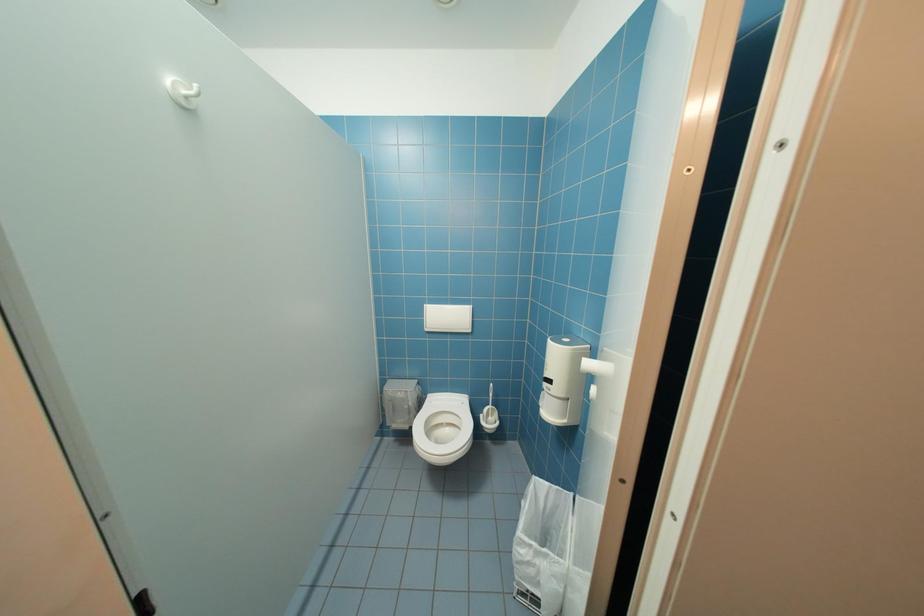
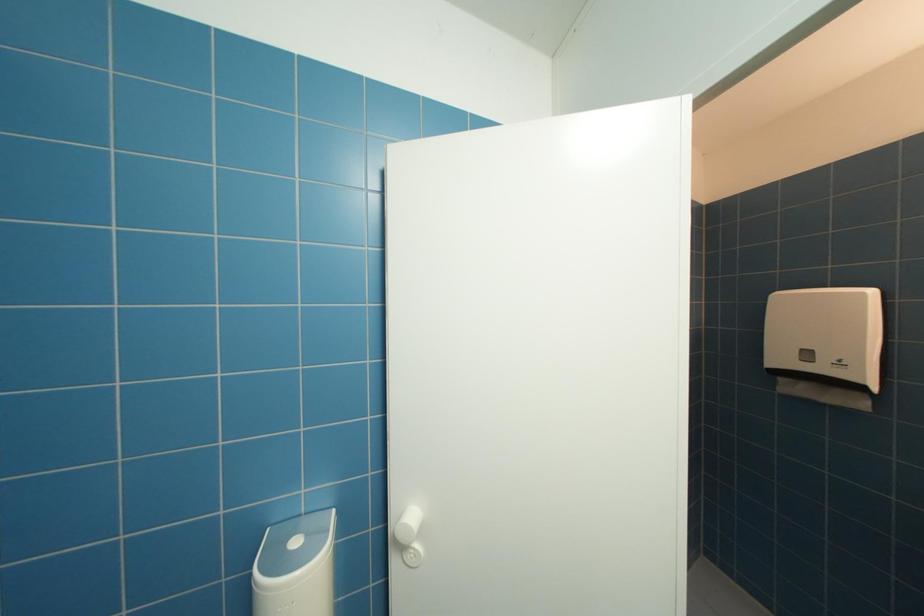
Question: The camera is either moving clockwise (left) or counter-clockwise (right) around the object. The first image is from the beginning of the video and the second image is from the end. Is the camera moving left or right when shooting the video?

Choices:
 (A) Left
 (B) Right

Answer: (A)